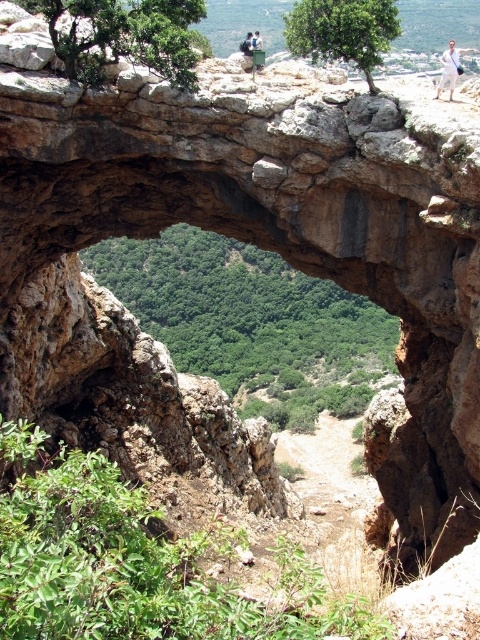
Question: Which point appears closest to the camera in this image?

Choices:
 (A) (244, 42)
 (B) (383, 16)
 (C) (442, 81)

Answer: (B)

Question: Is light brown leather jacket at upper center to the left of white cotton shirt at upper center from the viewer's perspective?

Choices:
 (A) no
 (B) yes

Answer: (B)

Question: Which point is farther from the camera taking this photo?

Choices:
 (A) (249, 413)
 (B) (262, 40)

Answer: (B)

Question: Is green leafy tree at upper left to the left of white cotton pants at upper right from the viewer's perspective?

Choices:
 (A) yes
 (B) no

Answer: (A)

Question: Does green leafy tree at center come in front of green leafy tree at upper left?

Choices:
 (A) yes
 (B) no

Answer: (B)

Question: Based on their relative distances, which object is nearer to the white cotton shirt at upper center?

Choices:
 (A) white cotton pants at upper right
 (B) green leafy tree at center
 (C) light brown leather jacket at upper center

Answer: (C)